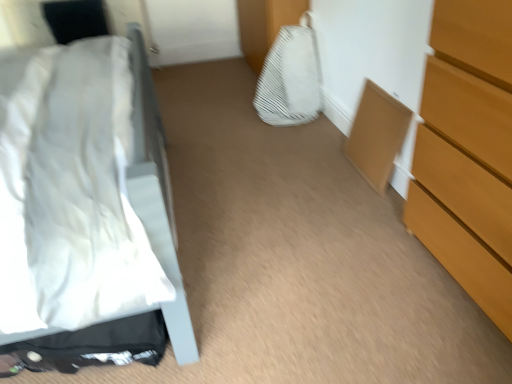
What do you see at coordinates (377, 135) in the screenshot?
I see `matte wood cabinet at lower right` at bounding box center [377, 135].

The width and height of the screenshot is (512, 384). What do you see at coordinates (290, 79) in the screenshot?
I see `white textured fabric at center` at bounding box center [290, 79].

Describe the element at coordinates (158, 203) in the screenshot. This screenshot has width=512, height=384. I see `white matte bed at left` at that location.

Find the location of a particular element. This screenshot has height=384, width=512. matte wood cabinet at lower right is located at coordinates (377, 135).

Between point (384, 123) and point (163, 191), which one is positioned behind?

The point (384, 123) is farther.

Considering the relative sizes of matte wood cabinet at lower right and white matte bed at left in the image provided, is matte wood cabinet at lower right smaller than white matte bed at left?

Yes, matte wood cabinet at lower right is smaller than white matte bed at left.

From a real-world perspective, which object rests below the other?

From a 3D spatial view, matte wood cabinet at lower right is below.

Relative to white matte bed at left, is matte wood cabinet at lower right in front or behind?

matte wood cabinet at lower right is positioned farther from the viewer than white matte bed at left.

Is white matte bed at left oriented towards white textured fabric at center?

Yes, white matte bed at left faces towards white textured fabric at center.

Between white matte bed at left and white textured fabric at center, which one has smaller size?

white textured fabric at center is smaller.

What's the angular difference between white matte bed at left and white textured fabric at center's facing directions?

white matte bed at left and white textured fabric at center are facing 179 degrees away from each other.

Identify the location of sheet behind the white matte bed at left. The image size is (512, 384). (290, 79).

How far apart are white matte bed at left and matte wood cabinet at lower right?

white matte bed at left and matte wood cabinet at lower right are 39.07 inches apart.

Considering the sizes of white matte bed at left and matte wood cabinet at lower right in the image, is white matte bed at left taller or shorter than matte wood cabinet at lower right?

Clearly, white matte bed at left is taller compared to matte wood cabinet at lower right.

Is white matte bed at left located outside matte wood cabinet at lower right?

white matte bed at left is positioned outside matte wood cabinet at lower right.

From the image's perspective, does white matte bed at left appear lower than matte wood cabinet at lower right?

Correct, white matte bed at left appears lower than matte wood cabinet at lower right in the image.

Are matte wood cabinet at lower right and white textured fabric at center far apart?

No.

Can you confirm if matte wood cabinet at lower right is positioned to the left of white textured fabric at center?

No.

From the picture: Which is in front, matte wood cabinet at lower right or white textured fabric at center?

matte wood cabinet at lower right.

Is matte wood cabinet at lower right not within white textured fabric at center?

Absolutely, matte wood cabinet at lower right is external to white textured fabric at center.

Between white textured fabric at center and matte wood cabinet at lower right, which one appears on the left side from the viewer's perspective?

Positioned to the left is white textured fabric at center.

From the image's perspective, is white textured fabric at center positioned above or below matte wood cabinet at lower right?

From the image's perspective, white textured fabric at center appears above matte wood cabinet at lower right.

Consider the image. From a real-world perspective, is white textured fabric at center beneath matte wood cabinet at lower right?

Actually, white textured fabric at center is physically above matte wood cabinet at lower right in the real world.

Considering the relative positions of white textured fabric at center and matte wood cabinet at lower right in the image provided, is white textured fabric at center in front of matte wood cabinet at lower right?

That is False.

Is white textured fabric at center far from wooden chest of drawers at right?

Yes, white textured fabric at center is far from wooden chest of drawers at right.

Which is correct: white textured fabric at center is inside wooden chest of drawers at right, or outside of it?

white textured fabric at center exists outside the volume of wooden chest of drawers at right.

Can you confirm if white textured fabric at center is thinner than wooden chest of drawers at right?

Correct, the width of white textured fabric at center is less than that of wooden chest of drawers at right.

Is point (314, 56) in front of point (510, 316)?

No, (314, 56) is behind (510, 316).

Which is more to the left, white matte bed at left or wooden chest of drawers at right?

white matte bed at left is more to the left.

Where is `bed on the left of wooden chest of drawers at right`? The width and height of the screenshot is (512, 384). bed on the left of wooden chest of drawers at right is located at coordinates (158, 203).

Does white matte bed at left have a lesser height compared to wooden chest of drawers at right?

In fact, white matte bed at left may be taller than wooden chest of drawers at right.

Measure the distance from white matte bed at left to wooden chest of drawers at right.

white matte bed at left is 90.50 centimeters from wooden chest of drawers at right.

Where is `cabinetry to the right of white matte bed at left`? This screenshot has width=512, height=384. cabinetry to the right of white matte bed at left is located at coordinates (377, 135).

Identify the location of bed located above the white textured fabric at center (from a real-world perspective). (158, 203).

Looking at the image, which one is located further to white matte bed at left, matte wood cabinet at lower right or white textured fabric at center?

matte wood cabinet at lower right is positioned further to the anchor white matte bed at left.

Which object lies nearer to the anchor point white matte bed at left, wooden chest of drawers at right or matte wood cabinet at lower right?

wooden chest of drawers at right lies closer to white matte bed at left than the other object.

Considering their positions, is white matte bed at left positioned closer to wooden chest of drawers at right than matte wood cabinet at lower right?

matte wood cabinet at lower right lies closer to wooden chest of drawers at right than the other object.

Considering their positions, is white textured fabric at center positioned closer to white matte bed at left than matte wood cabinet at lower right?

Based on the image, white textured fabric at center appears to be nearer to white matte bed at left.

When comparing their distances from white textured fabric at center, does wooden chest of drawers at right or matte wood cabinet at lower right seem closer?

The object closer to white textured fabric at center is matte wood cabinet at lower right.

Looking at the image, which one is located closer to white textured fabric at center, matte wood cabinet at lower right or wooden chest of drawers at right?

matte wood cabinet at lower right lies closer to white textured fabric at center than the other object.

Estimate the real-world distances between objects in this image. Which object is closer to matte wood cabinet at lower right, white matte bed at left or wooden chest of drawers at right?

The object closer to matte wood cabinet at lower right is wooden chest of drawers at right.

Looking at this image, when comparing their distances from white textured fabric at center, does white matte bed at left or wooden chest of drawers at right seem further?

wooden chest of drawers at right lies further to white textured fabric at center than the other object.

In order to click on cabinetry located between wooden chest of drawers at right and white textured fabric at center in the depth direction in this screenshot , I will do `click(377, 135)`.

This screenshot has height=384, width=512. I want to click on cabinetry between white matte bed at left and wooden chest of drawers at right from left to right, so click(x=377, y=135).

The width and height of the screenshot is (512, 384). I want to click on cabinetry positioned between white matte bed at left and white textured fabric at center from near to far, so click(x=377, y=135).

Identify the location of the chest of drawers located between white matte bed at left and white textured fabric at center in the depth direction. (468, 152).